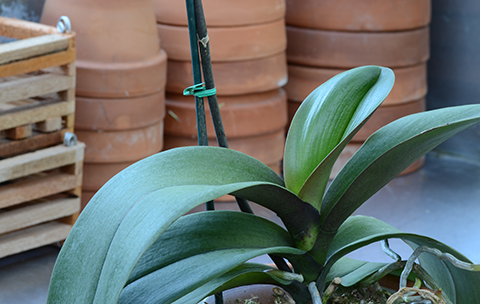
Locate an element on the screen. top of the pot holding the plant is located at coordinates (227, 294).